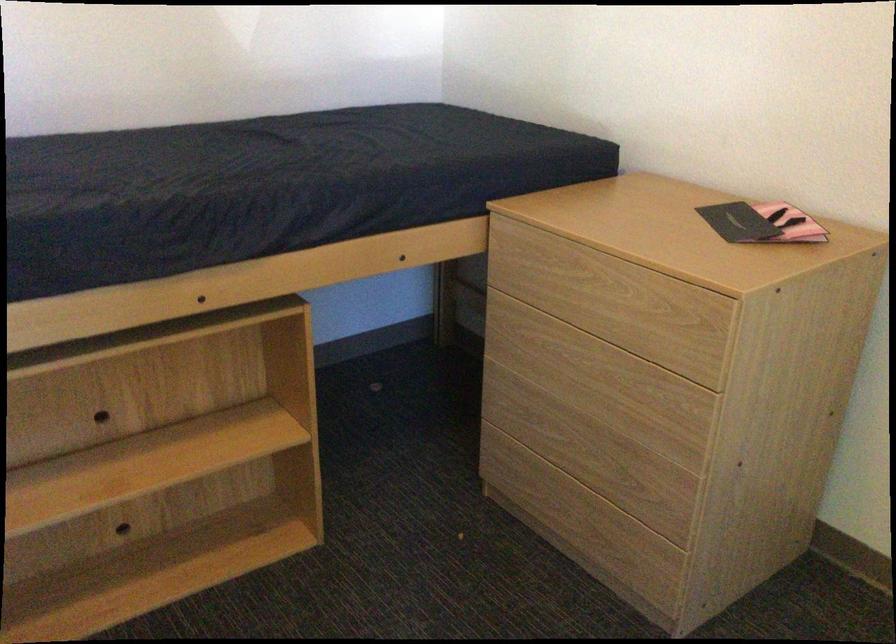
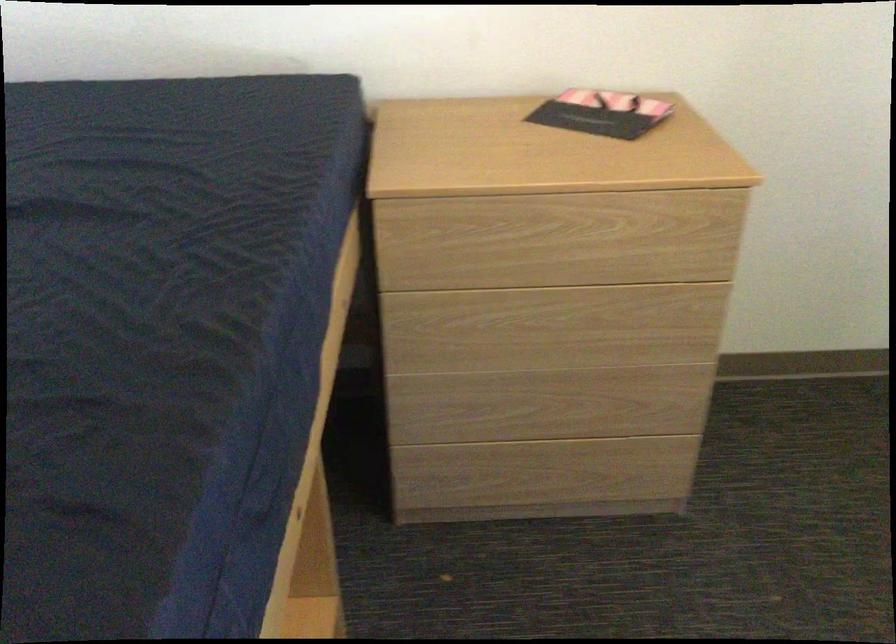
Locate, in the second image, the point that corresponds to (x=746, y=220) in the first image.

(600, 113)